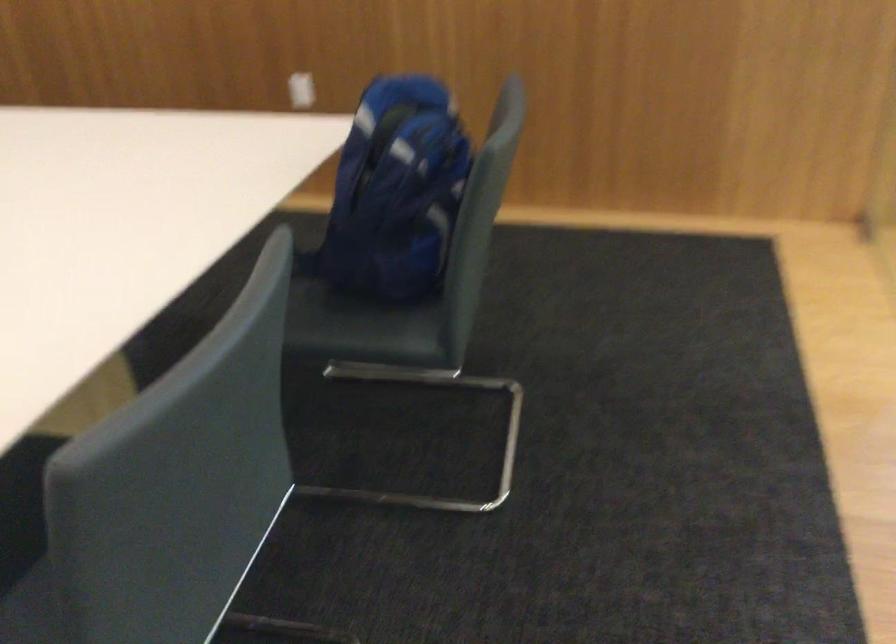
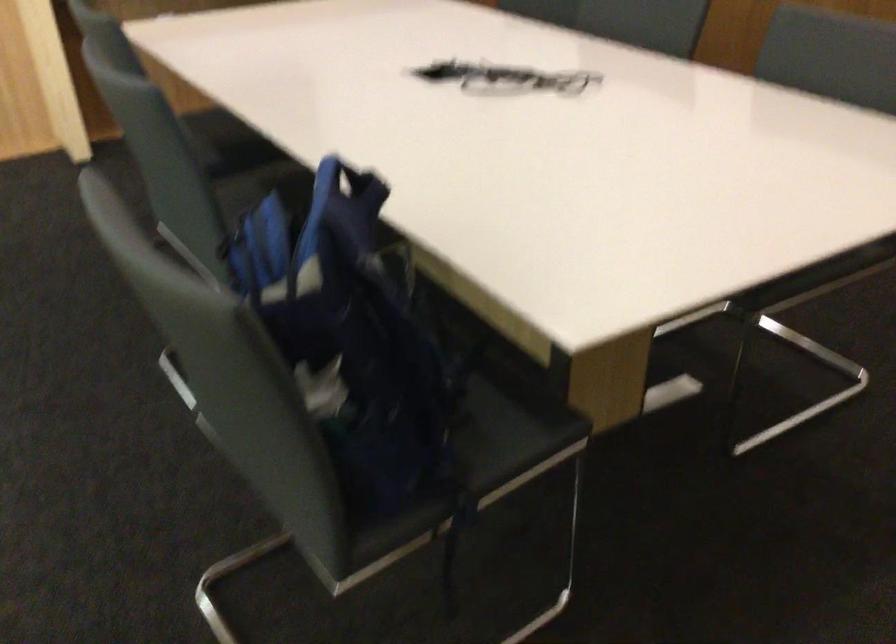
Find the pixel in the second image that matches pixel 351 259 in the first image.

(484, 451)